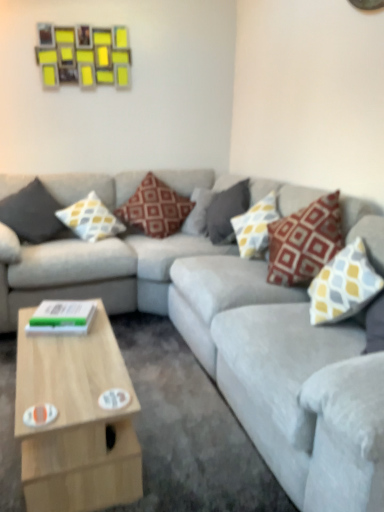
You are a GUI agent. You are given a task and a screenshot of the screen. Output one action in this format:
    pyautogui.click(x=<x>, y=<y>)
    Task: Click on the free point above light wood coffee table at lower left (from a real-world perspective)
    This screenshot has height=512, width=384.
    Given the screenshot: What is the action you would take?
    pyautogui.click(x=78, y=356)